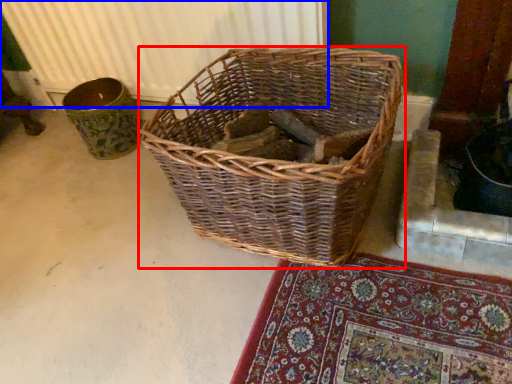
Question: Which point is closer to the camera, picnic basket (highlighted by a red box) or radiator (highlighted by a blue box)?

Choices:
 (A) picnic basket
 (B) radiator

Answer: (A)